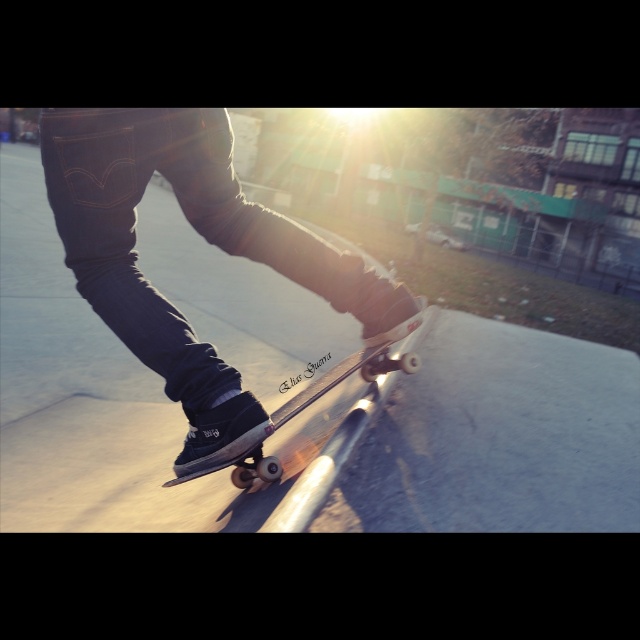
Is point (163, 376) more distant than point (337, 364)?

No, it is in front of (337, 364).

Who is shorter, matte black skateboarding shoe at center or wooden skateboard at center?

wooden skateboard at center

This screenshot has height=640, width=640. Describe the element at coordinates (204, 237) in the screenshot. I see `matte black skateboarding shoe at center` at that location.

Identify the location of matte black skateboarding shoe at center. This screenshot has width=640, height=640. (204, 237).